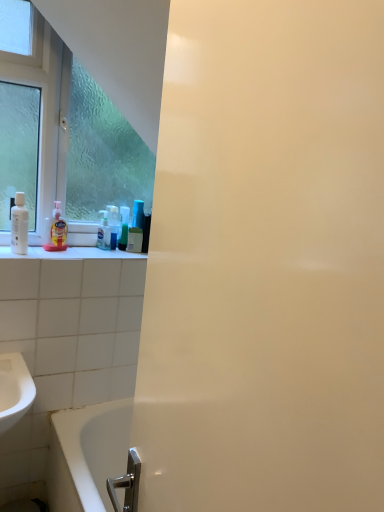
Question: Is the position of translucent plastic mouthwash at center, the second mouthwash in the left-to-right sequence, less distant than that of white glossy bottle at left, which is the 2th mouthwash from back to front?

Choices:
 (A) yes
 (B) no

Answer: (B)

Question: Is white glossy bottle at left, the second mouthwash from the right, located within translucent plastic mouthwash at center, the second mouthwash in the left-to-right sequence?

Choices:
 (A) yes
 (B) no

Answer: (B)

Question: Is translucent plastic mouthwash at center, which ranks as the 1th mouthwash in back-to-front order, looking in the opposite direction of white glossy bottle at left, arranged as the first mouthwash when viewed from the front?

Choices:
 (A) yes
 (B) no

Answer: (B)

Question: Can you confirm if translucent plastic mouthwash at center, the 2th mouthwash in the front-to-back sequence, is smaller than white glossy bottle at left, which is the 2th mouthwash from back to front?

Choices:
 (A) no
 (B) yes

Answer: (B)

Question: Is translucent plastic mouthwash at center, the 2th mouthwash in the front-to-back sequence, not close to white glossy bottle at left, which is the 2th mouthwash from back to front?

Choices:
 (A) no
 (B) yes

Answer: (A)

Question: Choose the correct answer: Is white glossy bottle at left, the second mouthwash from the right, inside white glossy bathtub at lower left or outside it?

Choices:
 (A) inside
 (B) outside

Answer: (B)

Question: From a real-world perspective, relative to white glossy bathtub at lower left, is white glossy bottle at left, which is the 2th mouthwash from back to front, vertically above or below?

Choices:
 (A) above
 (B) below

Answer: (A)

Question: In the image, is white glossy bottle at left, the 1th mouthwash from the left, positioned in front of or behind white glossy bathtub at lower left?

Choices:
 (A) behind
 (B) front

Answer: (A)

Question: Considering the positions of white glossy bottle at left, arranged as the first mouthwash when viewed from the front, and white glossy bathtub at lower left in the image, is white glossy bottle at left, arranged as the first mouthwash when viewed from the front, wider or thinner than white glossy bathtub at lower left?

Choices:
 (A) thin
 (B) wide

Answer: (A)

Question: From the image's perspective, is translucent plastic mouthwash at center, which is the 1th mouthwash in right-to-left order, positioned above or below clear glass window at upper left?

Choices:
 (A) below
 (B) above

Answer: (A)

Question: From a real-world perspective, is translucent plastic mouthwash at center, which ranks as the 1th mouthwash in back-to-front order, positioned above or below clear glass window at upper left?

Choices:
 (A) above
 (B) below

Answer: (B)

Question: In the image, is translucent plastic mouthwash at center, the 2th mouthwash in the front-to-back sequence, positioned in front of or behind clear glass window at upper left?

Choices:
 (A) front
 (B) behind

Answer: (B)

Question: Considering the positions of translucent plastic mouthwash at center, which ranks as the 1th mouthwash in back-to-front order, and clear glass window at upper left in the image, is translucent plastic mouthwash at center, which ranks as the 1th mouthwash in back-to-front order, wider or thinner than clear glass window at upper left?

Choices:
 (A) wide
 (B) thin

Answer: (B)

Question: In terms of width, does white glossy bathtub at lower left look wider or thinner when compared to translucent plastic soap dispenser at left, the 2th cleaning product viewed from the back?

Choices:
 (A) thin
 (B) wide

Answer: (B)

Question: From the image's perspective, relative to translucent plastic soap dispenser at left, placed as the 2th cleaning product when sorted from right to left, is white glossy bathtub at lower left above or below?

Choices:
 (A) above
 (B) below

Answer: (B)